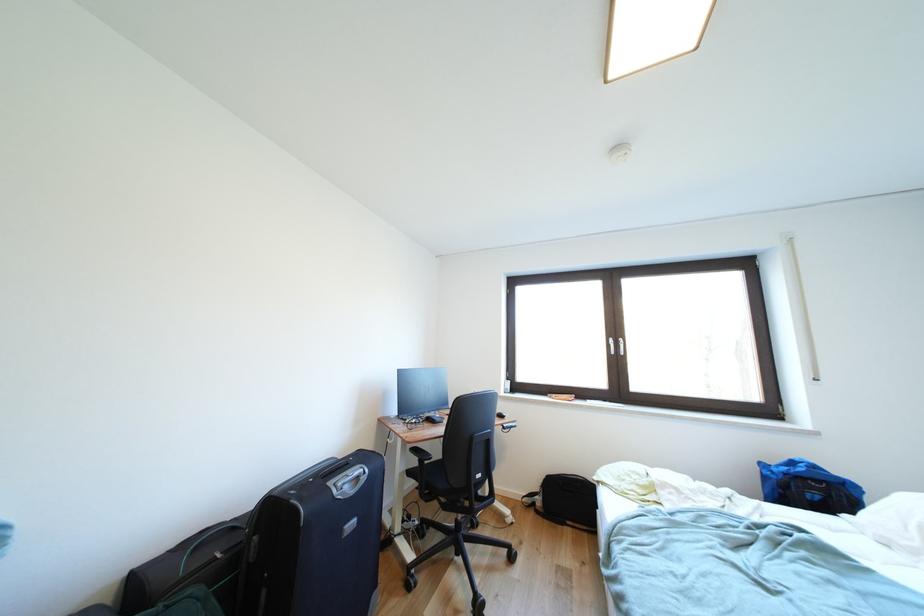
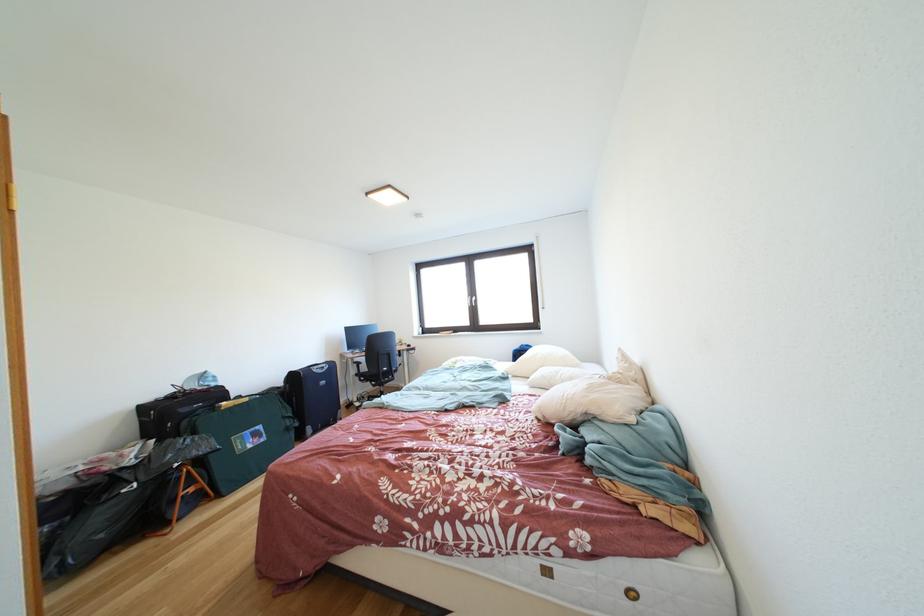
The point at (454, 512) is marked in the first image. Where is the corresponding point in the second image?

(383, 391)